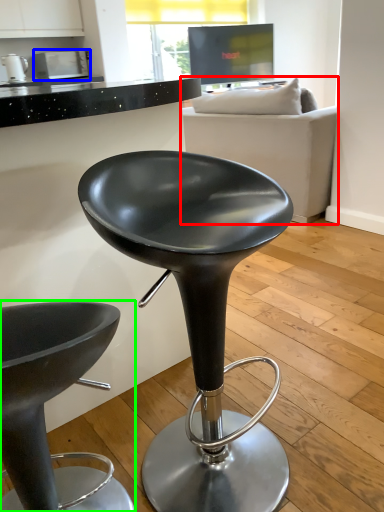
Question: Which object is positioned farthest from studio couch (highlighted by a red box)? Select from appliance (highlighted by a blue box) and chair (highlighted by a green box).

Choices:
 (A) appliance
 (B) chair

Answer: (A)